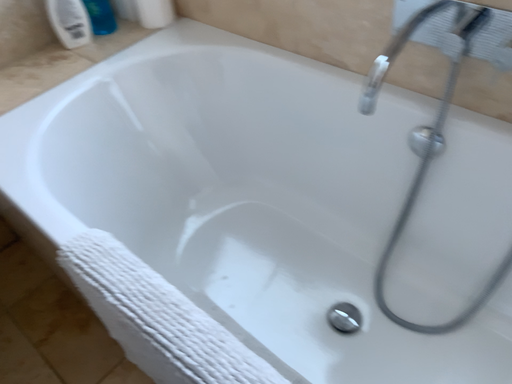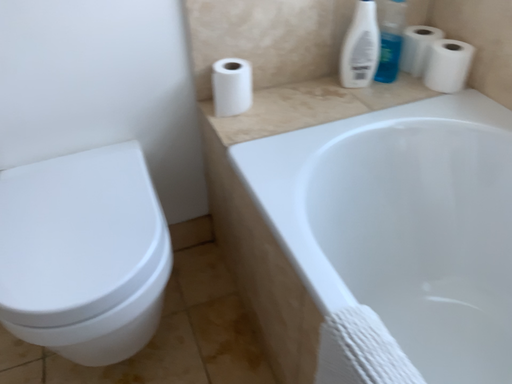
Question: How did the camera likely rotate when shooting the video?

Choices:
 (A) rotated upward
 (B) rotated downward

Answer: (A)